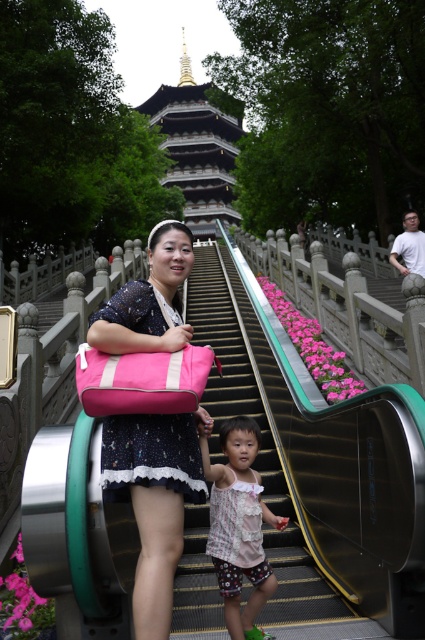
You are standing at the base of the escalator and notice two items at the center of the scene. Which one is taller between the pink fabric bag at center and the light pink fabric dress at center?

The pink fabric bag at center is much taller than the light pink fabric dress at center.